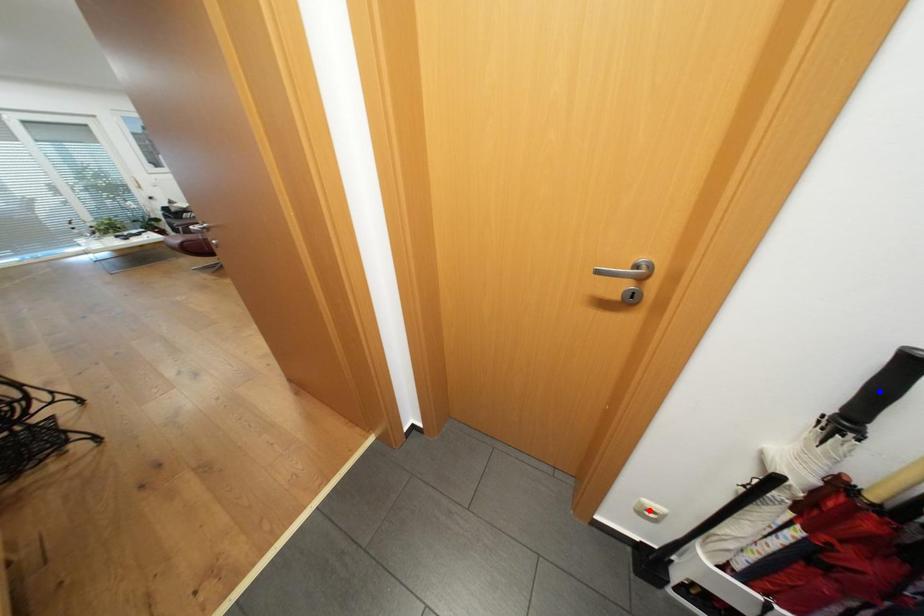
Question: In the image, two points are highlighted. Which point is nearer to the camera? Reply with the corresponding letter.

Choices:
 (A) blue point
 (B) red point

Answer: (A)